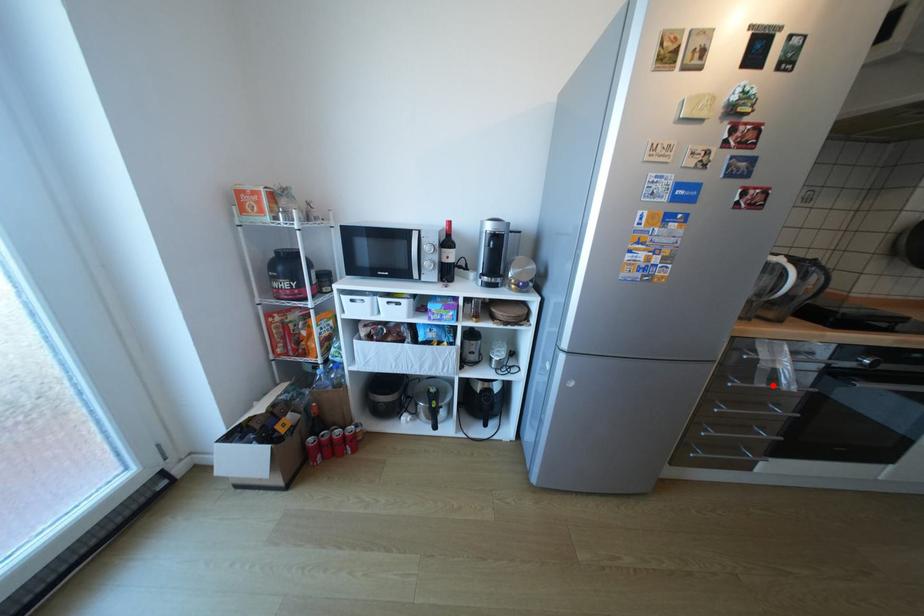
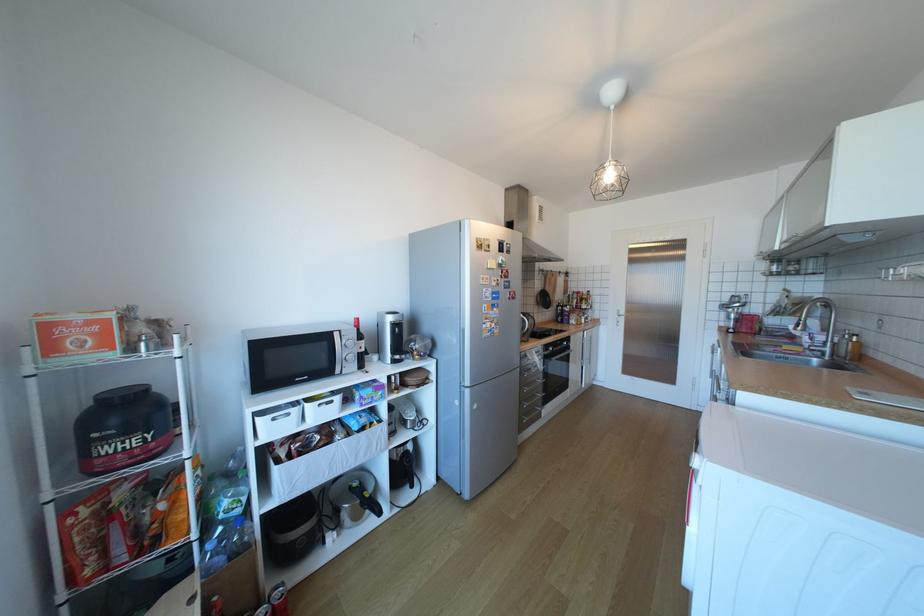
The point at the highlighted location is marked in the first image. Where is the corresponding point in the second image?

(543, 371)